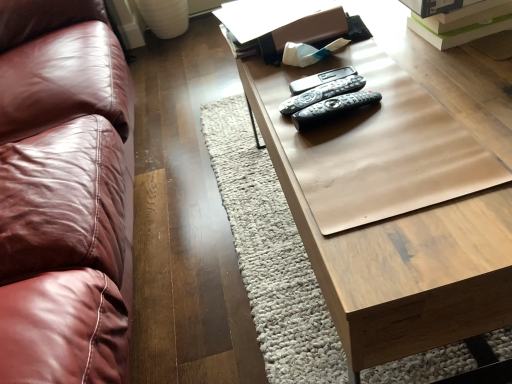
The image size is (512, 384). What are the coordinates of `vacant region to the left of black plastic remote at center, the third remote from the front` in the screenshot? It's located at (270, 101).